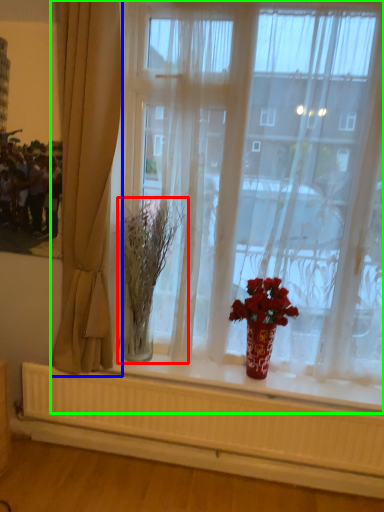
Question: Based on their relative distances, which object is farther from plant (highlighted by a red box)? Choose from curtain (highlighted by a blue box) and window (highlighted by a green box).

Choices:
 (A) curtain
 (B) window

Answer: (B)